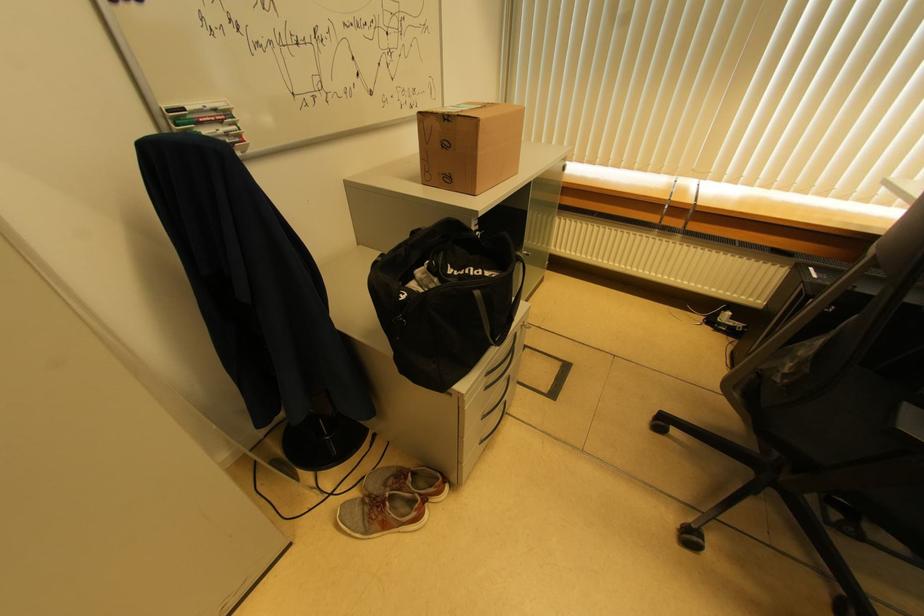
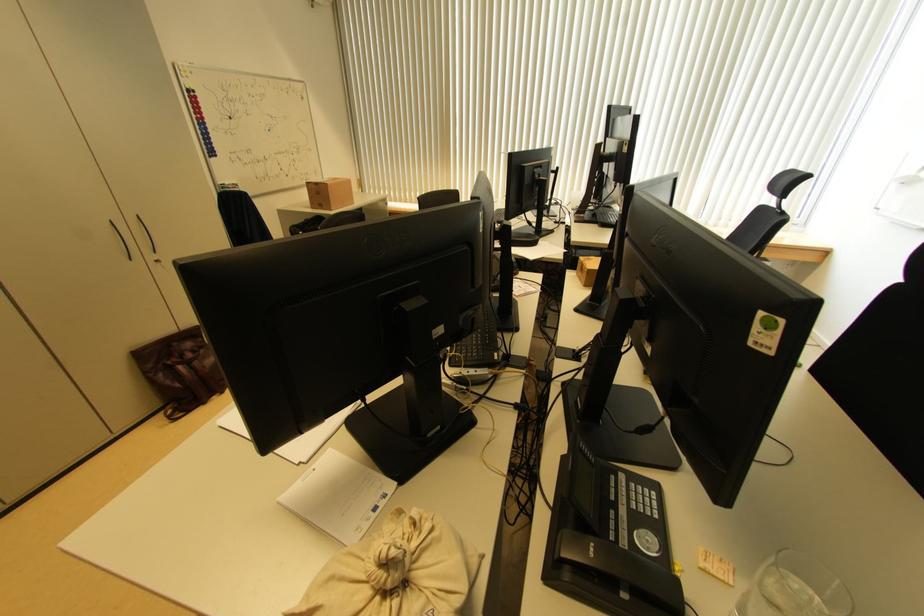
Locate, in the second image, the point that corresponds to (x=477, y=124) in the first image.

(329, 188)